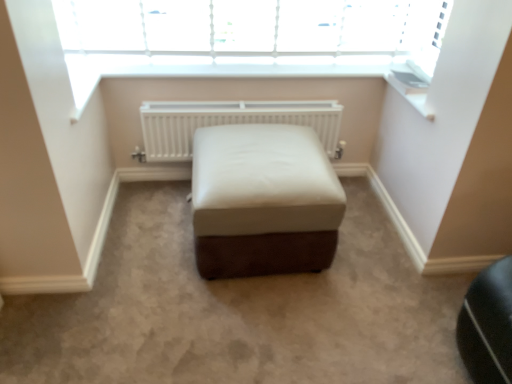
At what (x,y) coordinates should I click in order to perform the action: click on vacant area to the right of white leather ottoman at center. Please return your answer as a coordinate pair (x, y). Looking at the image, I should click on click(382, 258).